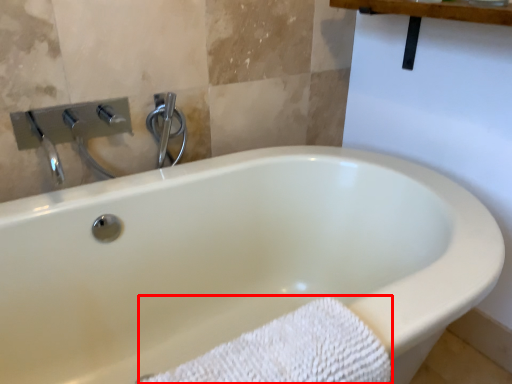
Question: From the image, what is the correct spatial relationship of bath towel (annotated by the red box) in relation to shower?

Choices:
 (A) left
 (B) right

Answer: (B)